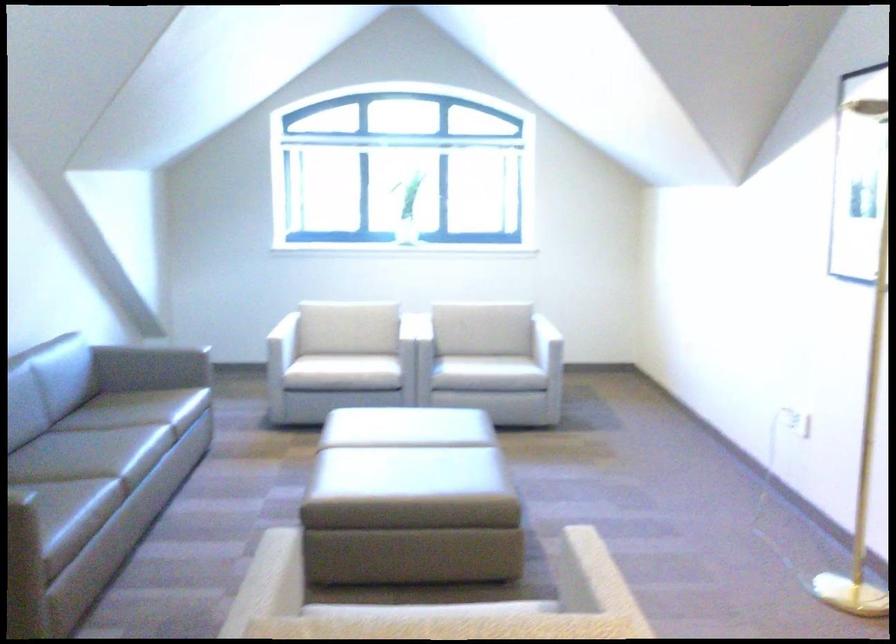
Describe the element at coordinates (99, 427) in the screenshot. I see `a sofa sitting surface` at that location.